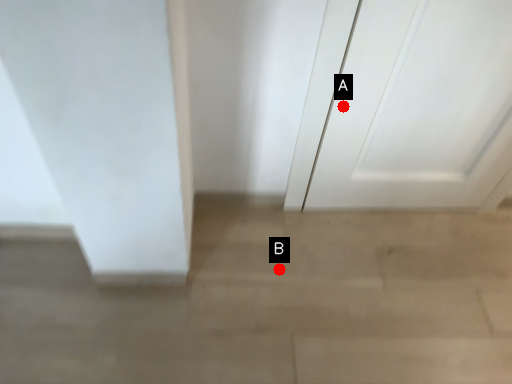
Question: Two points are circled on the image, labeled by A and B beside each circle. Which point is further to the camera?

Choices:
 (A) A is further
 (B) B is further

Answer: (B)